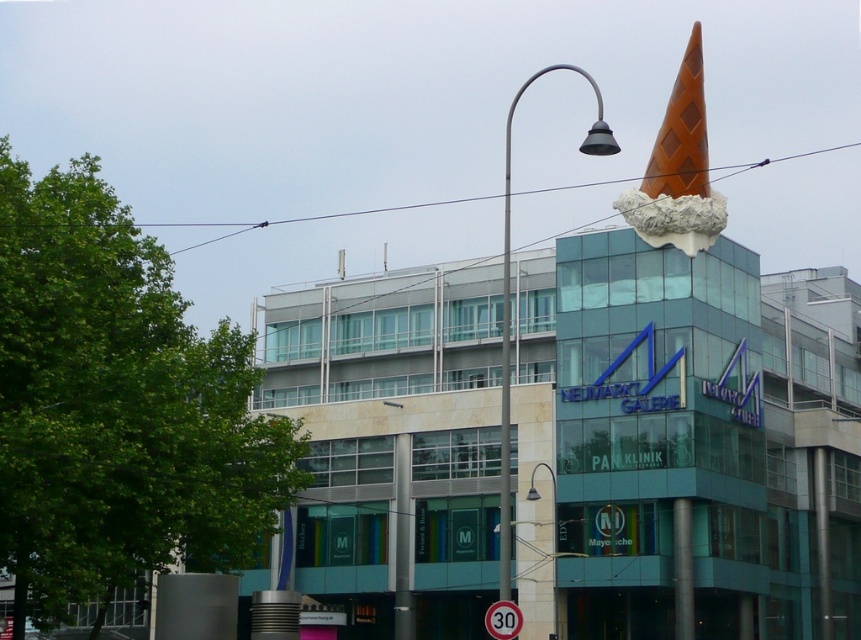
Question: Which point is closer to the camera taking this photo?

Choices:
 (A) (604, 131)
 (B) (713, 212)

Answer: (A)

Question: Does orange diamond-patterned ice cream cone at upper center appear on the left side of metallic gray streetlamp at upper center?

Choices:
 (A) no
 (B) yes

Answer: (A)

Question: From the image, what is the correct spatial relationship of orange diamond-patterned ice cream cone at upper center in relation to metallic gray streetlamp at upper center?

Choices:
 (A) left
 (B) right

Answer: (B)

Question: Which of the following is the farthest from the observer?

Choices:
 (A) (692, 81)
 (B) (505, 582)

Answer: (A)

Question: Considering the relative positions of orange diamond-patterned ice cream cone at upper center and metallic gray streetlamp at upper center in the image provided, where is orange diamond-patterned ice cream cone at upper center located with respect to metallic gray streetlamp at upper center?

Choices:
 (A) right
 (B) left

Answer: (A)